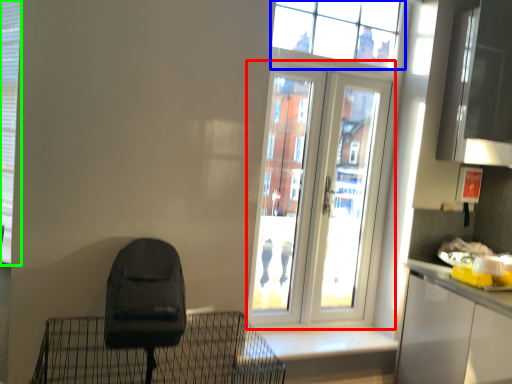
Question: Estimate the real-world distances between objects in this image. Which object is closer to door (highlighted by a red box), window (highlighted by a blue box) or shutter (highlighted by a green box)?

Choices:
 (A) window
 (B) shutter

Answer: (A)